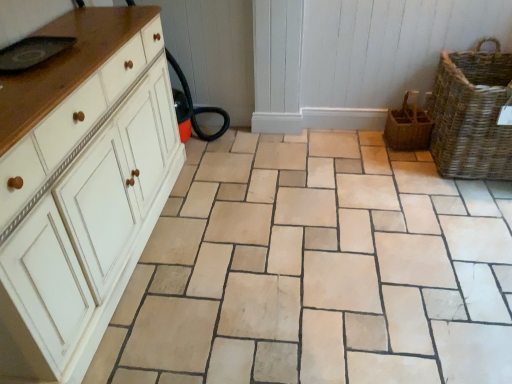
Describe the element at coordinates (80, 185) in the screenshot. The image size is (512, 384). I see `white painted wood chest of drawers at left` at that location.

At what (x,y) coordinates should I click in order to perform the action: click on white painted wood chest of drawers at left. Please return your answer as a coordinate pair (x, y). The width and height of the screenshot is (512, 384). Looking at the image, I should click on (80, 185).

This screenshot has width=512, height=384. What are the coordinates of `woven brown basket at right, the second basket viewed from the right` in the screenshot? It's located at (408, 125).

This screenshot has width=512, height=384. What are the coordinates of `beige stone tile at center` in the screenshot? It's located at (317, 270).

Describe the element at coordinates (471, 114) in the screenshot. This screenshot has height=384, width=512. I see `woven brown basket at right, placed as the second basket when sorted from left to right` at that location.

The height and width of the screenshot is (384, 512). I want to click on white painted wood chest of drawers at left, so click(x=80, y=185).

Does point (275, 266) come in front of point (71, 130)?

No, (275, 266) is behind (71, 130).

Is beige stone tile at center placed right next to white painted wood chest of drawers at left?

beige stone tile at center and white painted wood chest of drawers at left are clearly separated.

From their relative heights in the image, would you say beige stone tile at center is taller or shorter than white painted wood chest of drawers at left?

beige stone tile at center is shorter than white painted wood chest of drawers at left.

How much distance is there between beige stone tile at center and woven brown basket at right, placed as the second basket when sorted from left to right?

beige stone tile at center and woven brown basket at right, placed as the second basket when sorted from left to right, are 31.06 inches apart from each other.

Does point (217, 289) come closer to viewer compared to point (456, 86)?

Yes, it is in front of point (456, 86).

Is beige stone tile at center to the left or to the right of woven brown basket at right, placed as the second basket when sorted from left to right, in the image?

beige stone tile at center is positioned on woven brown basket at right, placed as the second basket when sorted from left to right,'s left side.

Based on the photo, how many degrees apart are the facing directions of beige stone tile at center and woven brown basket at right, the 1th basket viewed from the right?

93.3 degrees separate the facing orientations of beige stone tile at center and woven brown basket at right, the 1th basket viewed from the right.

Could you measure the distance between white painted wood chest of drawers at left and woven brown basket at right, placed as the second basket when sorted from left to right?

white painted wood chest of drawers at left and woven brown basket at right, placed as the second basket when sorted from left to right, are 5.98 feet apart from each other.

The height and width of the screenshot is (384, 512). I want to click on the 2nd basket above the white painted wood chest of drawers at left (from the image's perspective), so click(471, 114).

Considering the positions of points (111, 127) and (451, 171), is point (111, 127) closer to camera compared to point (451, 171)?

That is True.

Based on the photo, who is bigger, white painted wood chest of drawers at left or woven brown basket at right, the 1th basket viewed from the right?

Bigger between the two is white painted wood chest of drawers at left.

Can you see woven brown basket at right, the second basket viewed from the right, touching beige stone tile at center?

No, woven brown basket at right, the second basket viewed from the right, is not beside beige stone tile at center.

Can you confirm if woven brown basket at right, the second basket viewed from the right, is bigger than beige stone tile at center?

No, woven brown basket at right, the second basket viewed from the right, is not bigger than beige stone tile at center.

Consider the image. Does woven brown basket at right, the second basket viewed from the right, turn towards beige stone tile at center?

No, woven brown basket at right, the second basket viewed from the right, is not oriented towards beige stone tile at center.

Considering the positions of objects woven brown basket at right, the 1th basket in the left-to-right sequence, and beige stone tile at center in the image provided, who is in front, woven brown basket at right, the 1th basket in the left-to-right sequence, or beige stone tile at center?

beige stone tile at center.

Considering the relative sizes of beige stone tile at center and woven brown basket at right, the second basket viewed from the right, in the image provided, is beige stone tile at center wider than woven brown basket at right, the second basket viewed from the right,?

Yes.

From a real-world perspective, is beige stone tile at center physically located above or below woven brown basket at right, the 1th basket in the left-to-right sequence?

Clearly, from a real-world perspective, beige stone tile at center is below woven brown basket at right, the 1th basket in the left-to-right sequence.

Which point is more forward, (441, 329) or (408, 117)?

The point (441, 329) is more forward.

Considering the sizes of beige stone tile at center and woven brown basket at right, the 1th basket in the left-to-right sequence, in the image, is beige stone tile at center bigger or smaller than woven brown basket at right, the 1th basket in the left-to-right sequence,?

Clearly, beige stone tile at center is larger in size than woven brown basket at right, the 1th basket in the left-to-right sequence.

In terms of size, does white painted wood chest of drawers at left appear bigger or smaller than beige stone tile at center?

Considering their sizes, white painted wood chest of drawers at left takes up more space than beige stone tile at center.

Could beige stone tile at center be considered to be inside white painted wood chest of drawers at left?

No, beige stone tile at center is not inside white painted wood chest of drawers at left.

Is white painted wood chest of drawers at left closer to the viewer compared to beige stone tile at center?

Yes, white painted wood chest of drawers at left is in front of beige stone tile at center.

From the image's perspective, who appears lower, woven brown basket at right, the 1th basket in the left-to-right sequence, or woven brown basket at right, placed as the second basket when sorted from left to right?

woven brown basket at right, the 1th basket in the left-to-right sequence, is shown below in the image.

Is woven brown basket at right, the second basket viewed from the right, facing towards woven brown basket at right, the 1th basket viewed from the right?

No.

Does point (391, 119) lie in front of point (433, 129)?

No, (391, 119) is behind (433, 129).

Can you see woven brown basket at right, the 1th basket in the left-to-right sequence, touching woven brown basket at right, placed as the second basket when sorted from left to right?

No, woven brown basket at right, the 1th basket in the left-to-right sequence, is not beside woven brown basket at right, placed as the second basket when sorted from left to right.

The image size is (512, 384). Find the location of `ceramic tile on the right of the white painted wood chest of drawers at left`. ceramic tile on the right of the white painted wood chest of drawers at left is located at coordinates click(x=317, y=270).

Identify the location of ceramic tile on the left of woven brown basket at right, placed as the second basket when sorted from left to right. The image size is (512, 384). (317, 270).

From the image, which object appears to be farther from woven brown basket at right, the 1th basket in the left-to-right sequence, white painted wood chest of drawers at left or woven brown basket at right, the 1th basket viewed from the right?

white painted wood chest of drawers at left.

Considering their positions, is beige stone tile at center positioned further to white painted wood chest of drawers at left than woven brown basket at right, the 1th basket in the left-to-right sequence?

woven brown basket at right, the 1th basket in the left-to-right sequence.

Looking at the image, which one is located further to woven brown basket at right, placed as the second basket when sorted from left to right, white painted wood chest of drawers at left or beige stone tile at center?

Based on the image, white painted wood chest of drawers at left appears to be further to woven brown basket at right, placed as the second basket when sorted from left to right.

Looking at the image, which one is located closer to woven brown basket at right, the 1th basket in the left-to-right sequence, beige stone tile at center or woven brown basket at right, placed as the second basket when sorted from left to right?

Among the two, woven brown basket at right, placed as the second basket when sorted from left to right, is located nearer to woven brown basket at right, the 1th basket in the left-to-right sequence.

Which object lies nearer to the anchor point woven brown basket at right, the 1th basket viewed from the right, beige stone tile at center or woven brown basket at right, the 1th basket in the left-to-right sequence?

woven brown basket at right, the 1th basket in the left-to-right sequence.

Considering their positions, is woven brown basket at right, the 1th basket viewed from the right, positioned further to beige stone tile at center than woven brown basket at right, the 1th basket in the left-to-right sequence?

Based on the image, woven brown basket at right, the 1th basket in the left-to-right sequence, appears to be further to beige stone tile at center.

Considering their positions, is beige stone tile at center positioned further to woven brown basket at right, the 1th basket viewed from the right, than white painted wood chest of drawers at left?

white painted wood chest of drawers at left.

Estimate the real-world distances between objects in this image. Which object is further from woven brown basket at right, the second basket viewed from the right, woven brown basket at right, the 1th basket viewed from the right, or white painted wood chest of drawers at left?

white painted wood chest of drawers at left is further to woven brown basket at right, the second basket viewed from the right.

Find the location of a particular element. This screenshot has height=384, width=512. basket between beige stone tile at center and woven brown basket at right, the 1th basket in the left-to-right sequence, along the z-axis is located at coordinates (471, 114).

In order to click on ceramic tile located between white painted wood chest of drawers at left and woven brown basket at right, the second basket viewed from the right, in the left-right direction in this screenshot , I will do `click(317, 270)`.

Locate an element on the screen. The width and height of the screenshot is (512, 384). ceramic tile located between white painted wood chest of drawers at left and woven brown basket at right, placed as the second basket when sorted from left to right, in the left-right direction is located at coordinates (317, 270).

You are a GUI agent. You are given a task and a screenshot of the screen. Output one action in this format:
    pyautogui.click(x=<x>, y=<y>)
    Task: Click on the basket between white painted wood chest of drawers at left and woven brown basket at right, placed as the second basket when sorted from left to right, in the horizontal direction
    Image resolution: width=512 pixels, height=384 pixels.
    Given the screenshot: What is the action you would take?
    pyautogui.click(x=408, y=125)